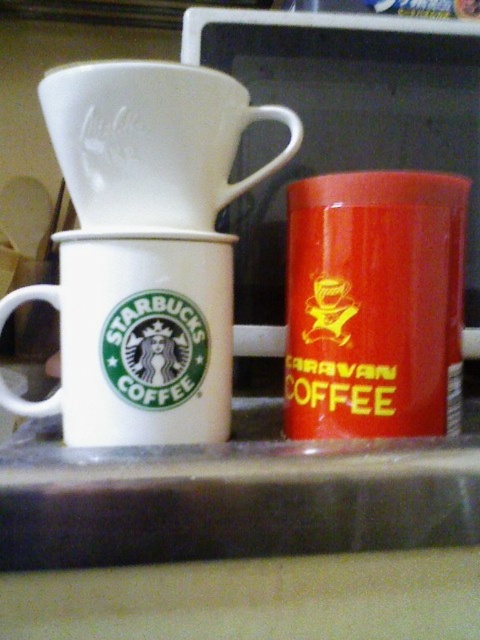
Measure the distance from white glossy mug at center to white matte coffee filter at upper center.

white glossy mug at center is 3.03 inches from white matte coffee filter at upper center.

Can you confirm if white glossy mug at center is positioned to the left of white matte coffee filter at upper center?

Indeed, white glossy mug at center is positioned on the left side of white matte coffee filter at upper center.

What do you see at coordinates (137, 339) in the screenshot? The width and height of the screenshot is (480, 640). I see `white glossy mug at center` at bounding box center [137, 339].

This screenshot has width=480, height=640. In order to click on white glossy mug at center in this screenshot , I will do `click(137, 339)`.

Is matte red coffee canister at right further to camera compared to white glossy mug at center?

Yes, it is behind white glossy mug at center.

Does matte red coffee canister at right have a greater width compared to white glossy mug at center?

No.

This screenshot has width=480, height=640. I want to click on matte red coffee canister at right, so click(374, 305).

Is point (396, 252) in front of point (100, 104)?

No, (396, 252) is behind (100, 104).

Identify the location of matte red coffee canister at right. (374, 305).

Identify the location of matte red coffee canister at right. (374, 305).